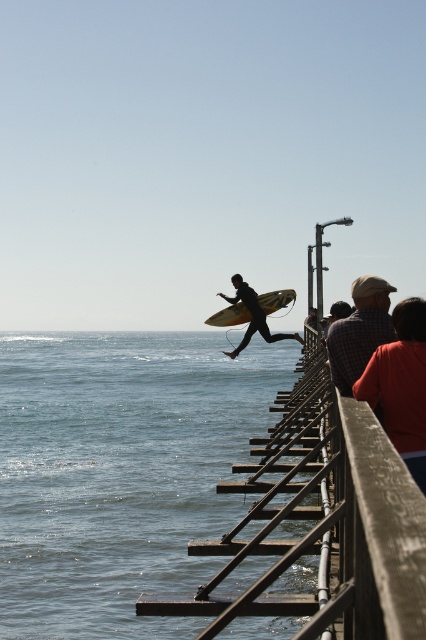
Does clear blue water at lower left appear on the left side of wooden surfboard at center?

Indeed, clear blue water at lower left is positioned on the left side of wooden surfboard at center.

Is clear blue water at lower left further to camera compared to wooden surfboard at center?

That is False.

Between point (63, 483) and point (276, 298), which one is positioned in front?

Point (63, 483) is more forward.

Where is `clear blue water at lower left`? clear blue water at lower left is located at coordinates (120, 472).

Can you confirm if silhouette surfboard at center is shorter than wooden surfboard at center?

In fact, silhouette surfboard at center may be taller than wooden surfboard at center.

Where is `silhouette surfboard at center`? Image resolution: width=426 pixels, height=640 pixels. silhouette surfboard at center is located at coordinates (253, 316).

Where is `silhouette surfboard at center`? The height and width of the screenshot is (640, 426). silhouette surfboard at center is located at coordinates (253, 316).

Which of these two, plaid shirt at center or silhouette surfboard at center, stands taller?

silhouette surfboard at center is taller.

Can you confirm if plaid shirt at center is taller than silhouette surfboard at center?

No.

Does point (363, 312) come behind point (261, 326)?

No, it is in front of (261, 326).

The height and width of the screenshot is (640, 426). I want to click on plaid shirt at center, so [359, 332].